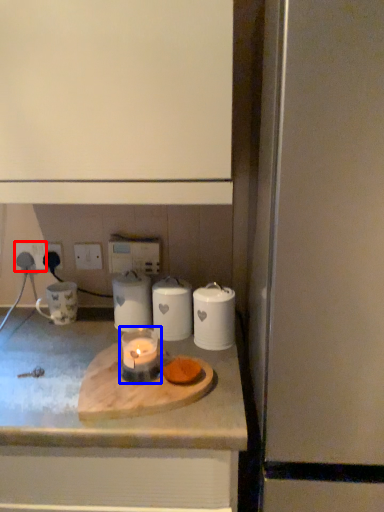
Question: Which object appears closest to the camera in this image, electric outlet (highlighted by a red box) or candle holder (highlighted by a blue box)?

Choices:
 (A) electric outlet
 (B) candle holder

Answer: (B)